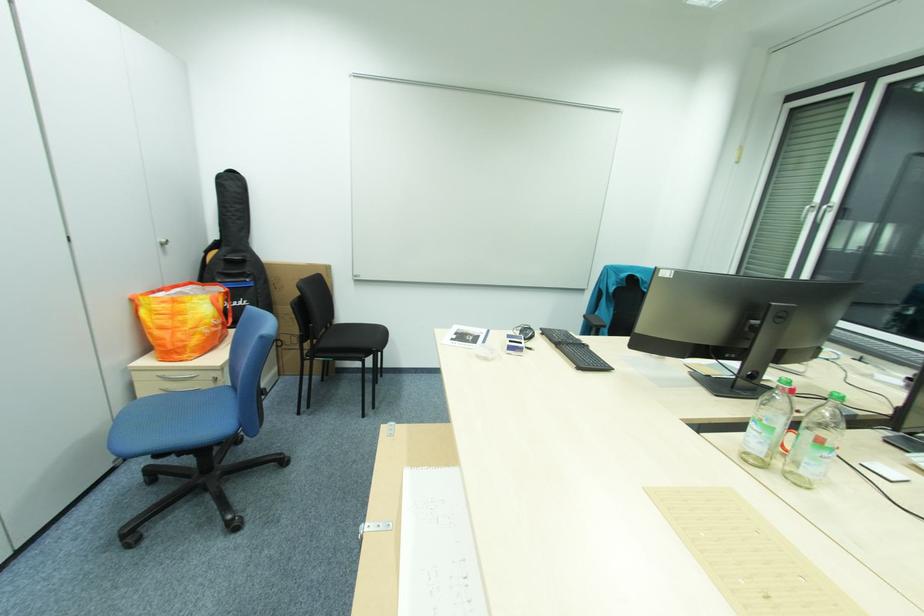
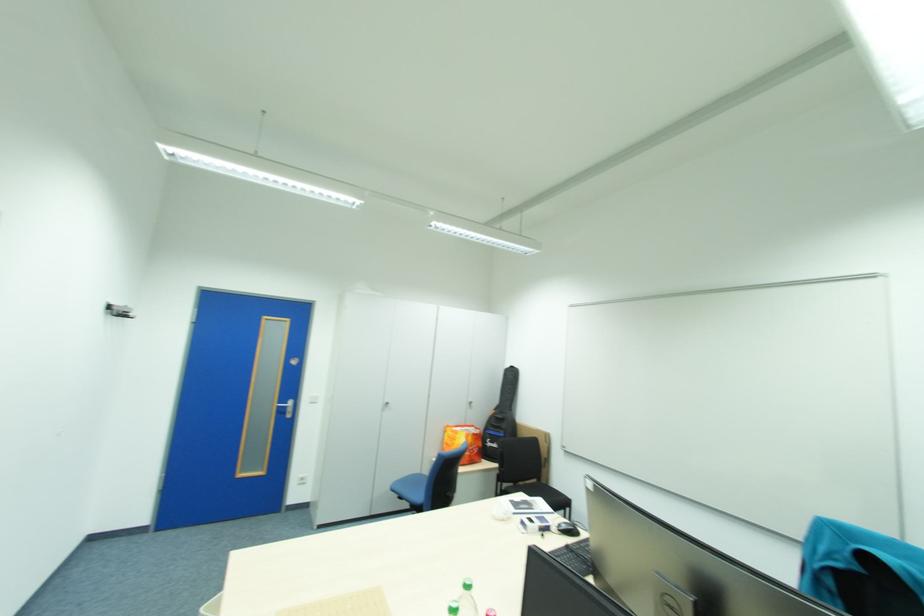
Where in the second image is the point corresponding to pixel 159 456 from the first image?

(407, 495)